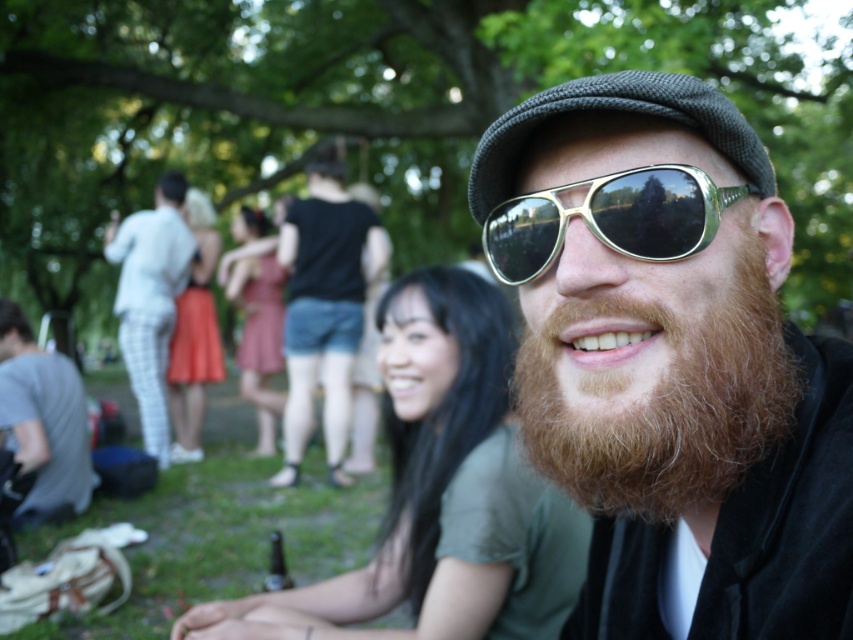
Which is more to the left, reddish-brown fuzzy beard at center or gold reflective sunglasses at center?

gold reflective sunglasses at center

Who is more forward, (619,316) or (611,205)?

Positioned in front is point (619,316).

Where is `reddish-brown fuzzy beard at center`? The width and height of the screenshot is (853, 640). reddish-brown fuzzy beard at center is located at coordinates (663, 401).

Who is lower down, black denim shorts at center or gray cotton t-shirt at lower left?

gray cotton t-shirt at lower left is below.

Is point (279, 232) positioned after point (86, 435)?

That is True.

Between point (340, 483) and point (59, 403), which one is positioned behind?

Point (340, 483)

Image resolution: width=853 pixels, height=640 pixels. I want to click on black denim shorts at center, so click(323, 305).

Between point (546, 472) and point (155, 234), which one is positioned in front?

Point (546, 472)

Does reddish-brown fuzzy beard at center have a lesser height compared to white checkered pants at center?

Indeed, reddish-brown fuzzy beard at center has a lesser height compared to white checkered pants at center.

The width and height of the screenshot is (853, 640). What are the coordinates of `reddish-brown fuzzy beard at center` in the screenshot? It's located at (663, 401).